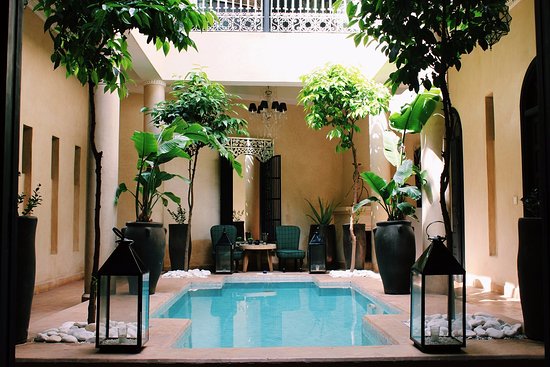
Identify the location of door on the side right. This screenshot has width=550, height=367. (268, 193).